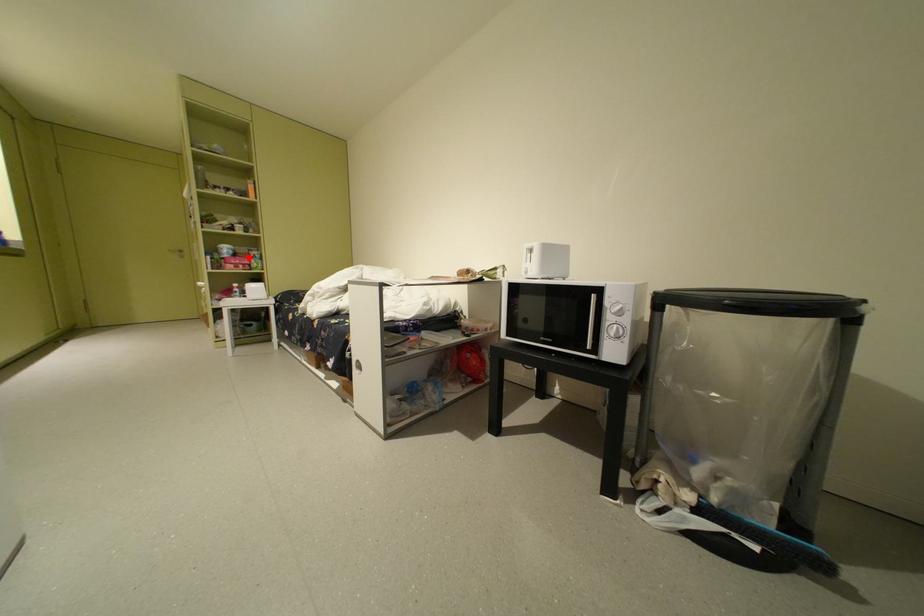
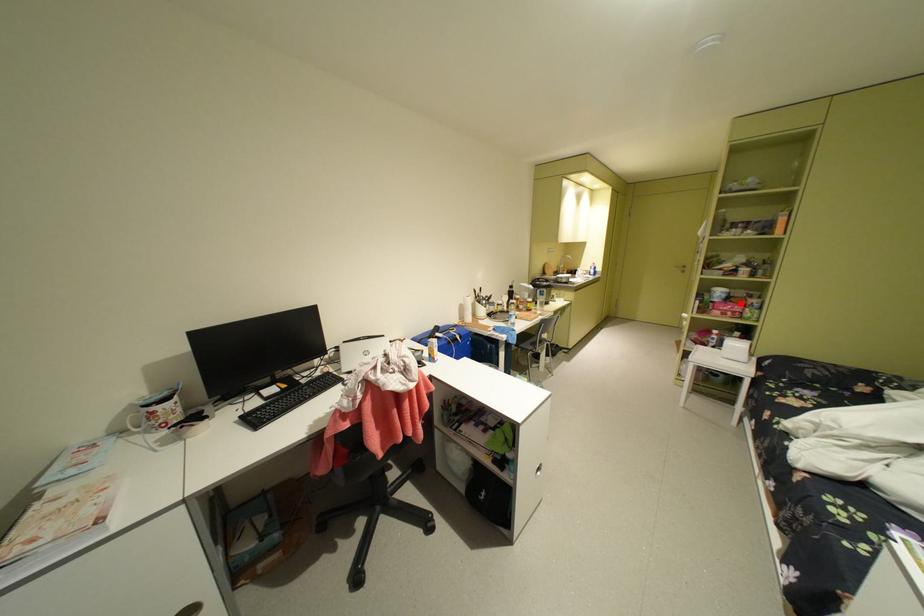
I am providing you with two images of the same scene from different viewpoints. A red point is marked on the first image and another point is marked on the second image. Is the red point in image1 aligned with the point shown in image2?

Yes